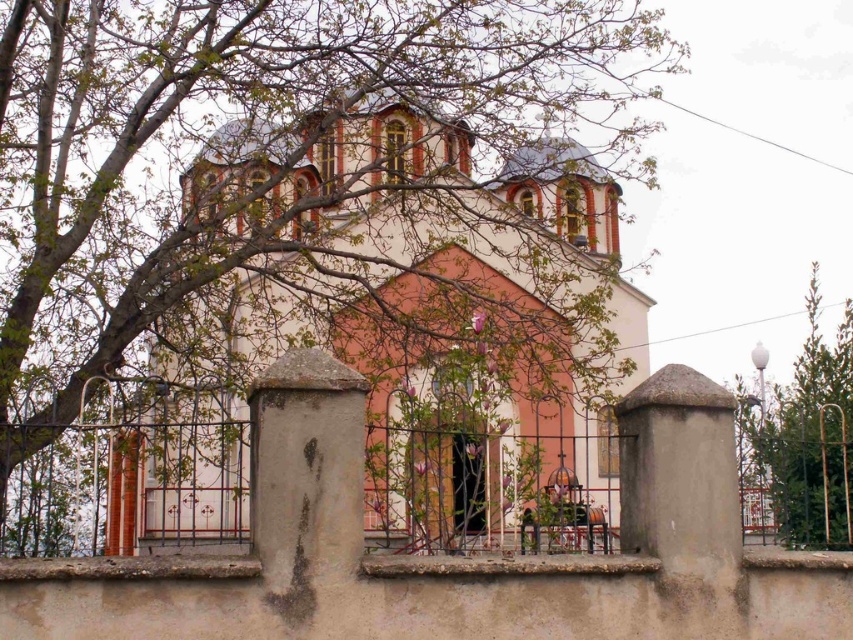
Question: Does bare branches at upper left have a greater width compared to green leafy tree at right?

Choices:
 (A) no
 (B) yes

Answer: (B)

Question: Does bare branches at upper left appear over green leafy tree at right?

Choices:
 (A) no
 (B) yes

Answer: (B)

Question: Which point is closer to the camera taking this photo?

Choices:
 (A) (782, 396)
 (B) (25, 365)

Answer: (B)

Question: Among these points, which one is nearest to the camera?

Choices:
 (A) (508, 20)
 (B) (805, 385)

Answer: (B)

Question: Does bare branches at upper left have a greater width compared to green leafy tree at right?

Choices:
 (A) yes
 (B) no

Answer: (A)